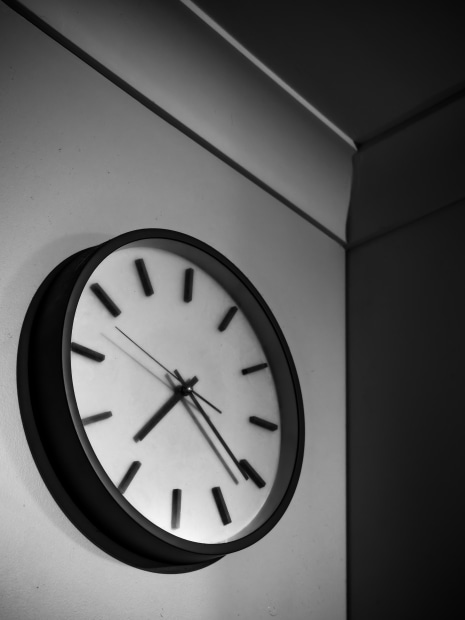
Locate an element on the screen. The width and height of the screenshot is (465, 620). white clock face is located at coordinates (202, 456).